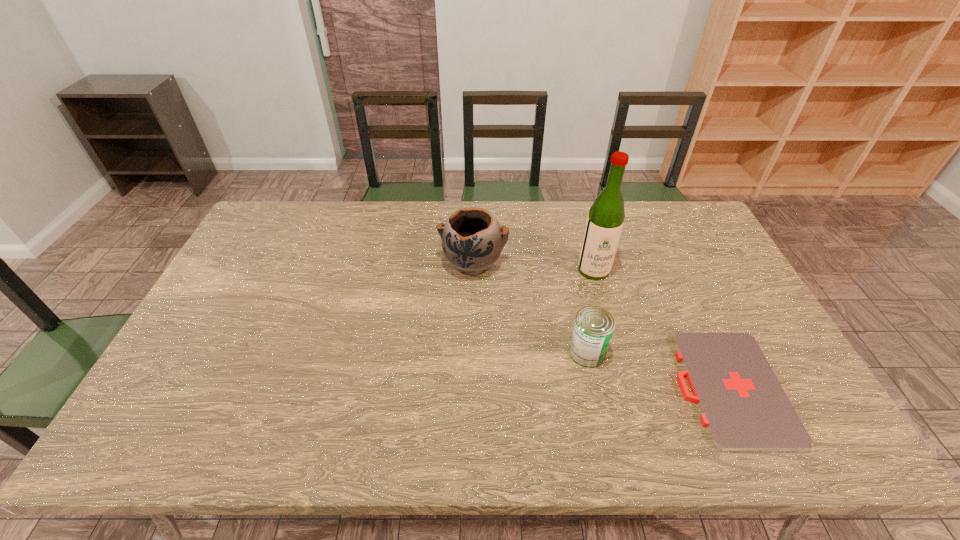
The height and width of the screenshot is (540, 960). Find the location of `liquor`. liquor is located at coordinates (604, 224).

You are a GUI agent. You are given a task and a screenshot of the screen. Output one action in this format:
    pyautogui.click(x=<x>, y=<y>)
    Task: Click on the leftmost object
    
    Given the screenshot: What is the action you would take?
    pyautogui.click(x=472, y=240)

Identify the location of pottery. (472, 240).

At what (x,y) coordinates should I click in order to perform the action: click on can. Please return your answer as a coordinate pair (x, y). Looking at the image, I should click on (594, 326).

Identify the location of the shortest object. (743, 406).

The height and width of the screenshot is (540, 960). Find the location of `the first-aid kit`. the first-aid kit is located at coordinates (743, 406).

Find the location of a particular element. The height and width of the screenshot is (540, 960). vacant space situated on the label of the liquor is located at coordinates (603, 305).

Where is `free spot located 0.230m on the back of the second tallest object`? The width and height of the screenshot is (960, 540). free spot located 0.230m on the back of the second tallest object is located at coordinates (474, 205).

The height and width of the screenshot is (540, 960). In order to click on vacant position located 0.090m on the right of the second shortest object in this screenshot , I will do `click(639, 353)`.

Locate an element on the screen. The height and width of the screenshot is (540, 960). vacant space situated on handle side the first-aid kit is located at coordinates (550, 389).